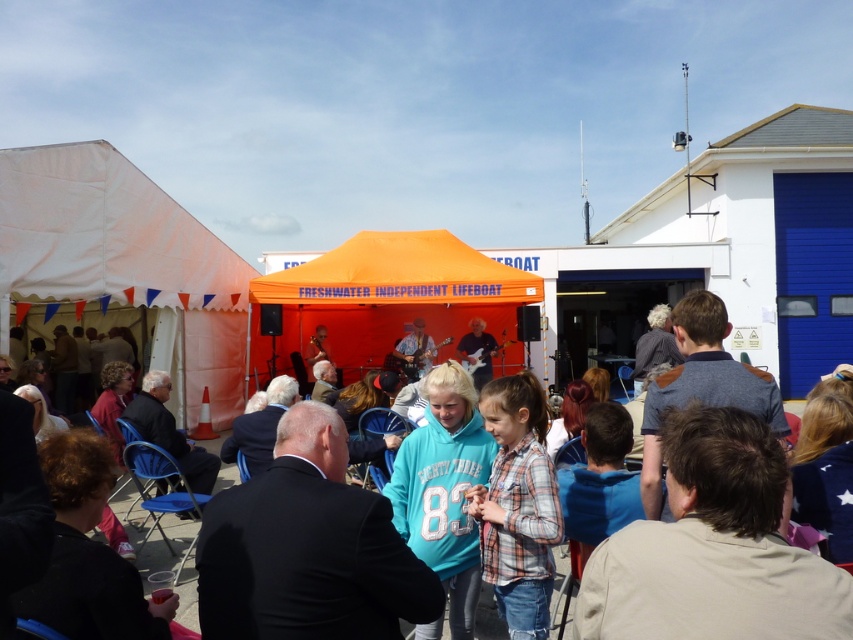
Question: Does white canvas tent at left appear on the right side of orange fabric tent at center?

Choices:
 (A) no
 (B) yes

Answer: (A)

Question: Among these points, which one is nearest to the camera?

Choices:
 (A) (131, 236)
 (B) (302, 330)

Answer: (A)

Question: Is white canvas tent at left positioned in front of orange fabric tent at center?

Choices:
 (A) yes
 (B) no

Answer: (A)

Question: In this image, where is white canvas tent at left located relative to orange fabric tent at center?

Choices:
 (A) below
 (B) above

Answer: (B)

Question: Among these points, which one is farthest from the camera?

Choices:
 (A) (496, 296)
 (B) (25, 253)

Answer: (A)